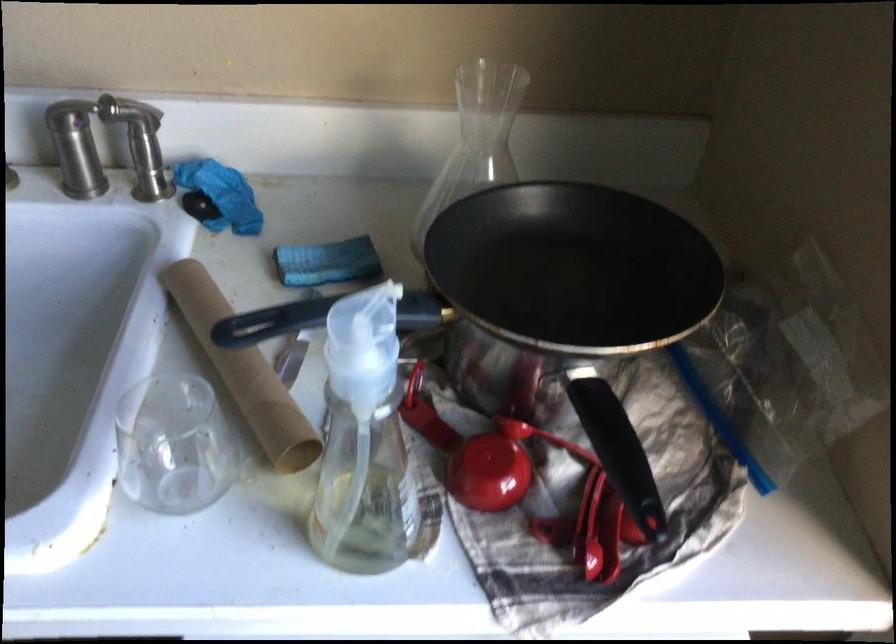
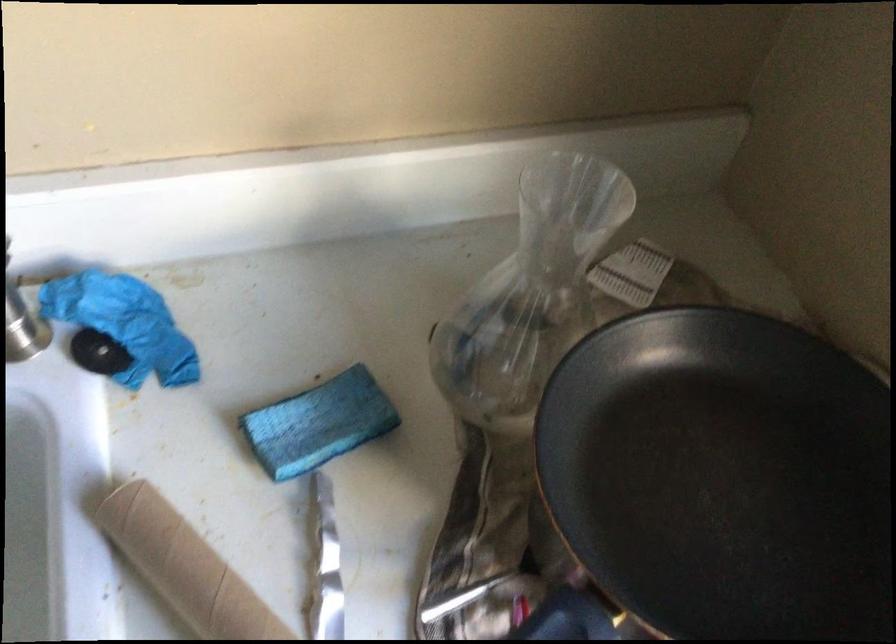
What movement of the cameraman would produce the second image?

The movement direction of the cameraman is left, forward.